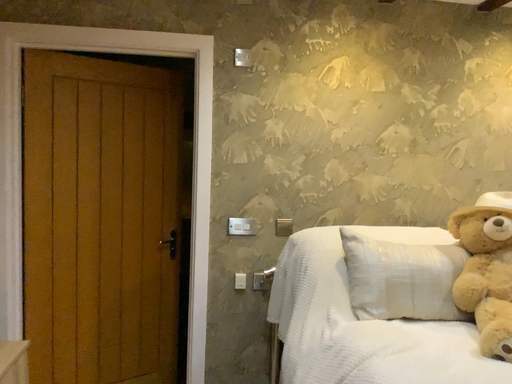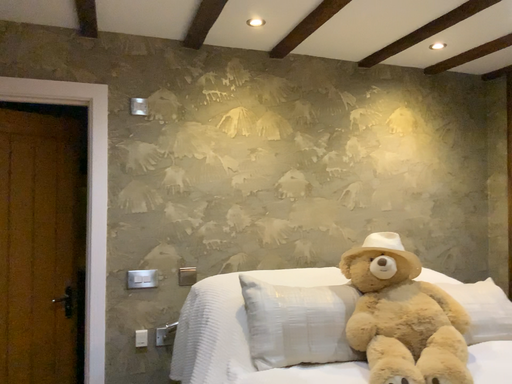
Question: Which way did the camera rotate in the video?

Choices:
 (A) rotated right
 (B) rotated left

Answer: (A)